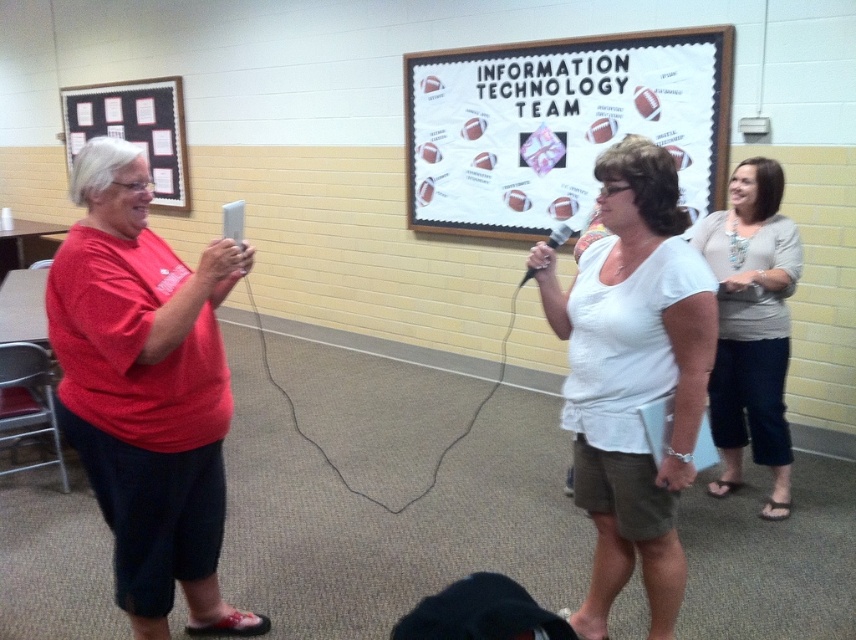
Question: Can you confirm if cardboard paper at upper left is positioned to the left of black plastic microphone at center?

Choices:
 (A) yes
 (B) no

Answer: (A)

Question: From the image, what is the correct spatial relationship of white paperboard at center in relation to gray fabric shirt at right?

Choices:
 (A) left
 (B) right

Answer: (A)

Question: Which is farther from the white paperboard at center?

Choices:
 (A) gray fabric shirt at right
 (B) black plastic microphone at center
 (C) white matte shirt at center

Answer: (C)

Question: Which object is farther from the camera taking this photo?

Choices:
 (A) gray fabric shirt at right
 (B) cardboard paper at upper left
 (C) white paperboard at center
 (D) white matte shirt at center

Answer: (B)

Question: Does gray fabric shirt at right appear over black plastic microphone at center?

Choices:
 (A) no
 (B) yes

Answer: (A)

Question: Which object is the farthest from the white matte shirt at center?

Choices:
 (A) black plastic microphone at center
 (B) cardboard paper at upper left
 (C) gray fabric shirt at right
 (D) white paperboard at center

Answer: (B)